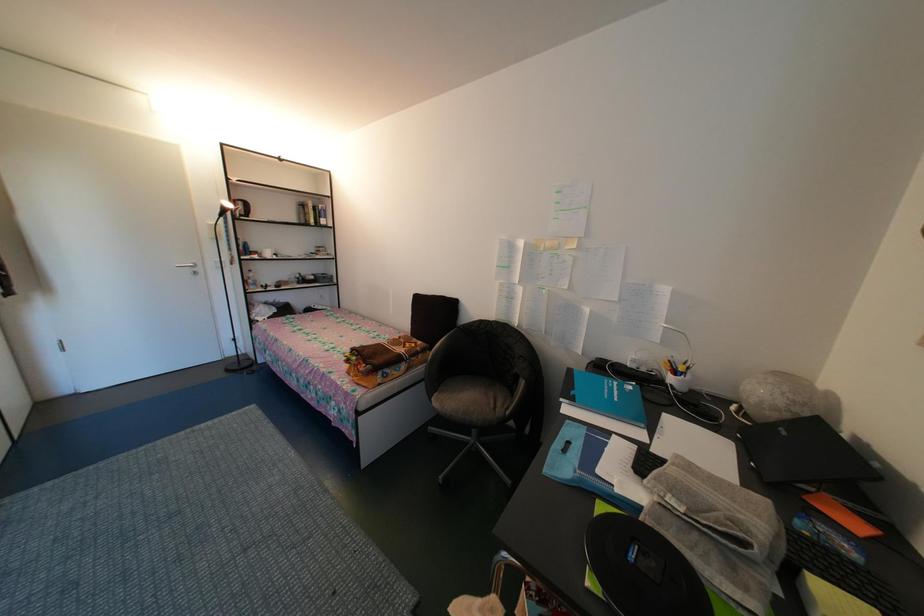
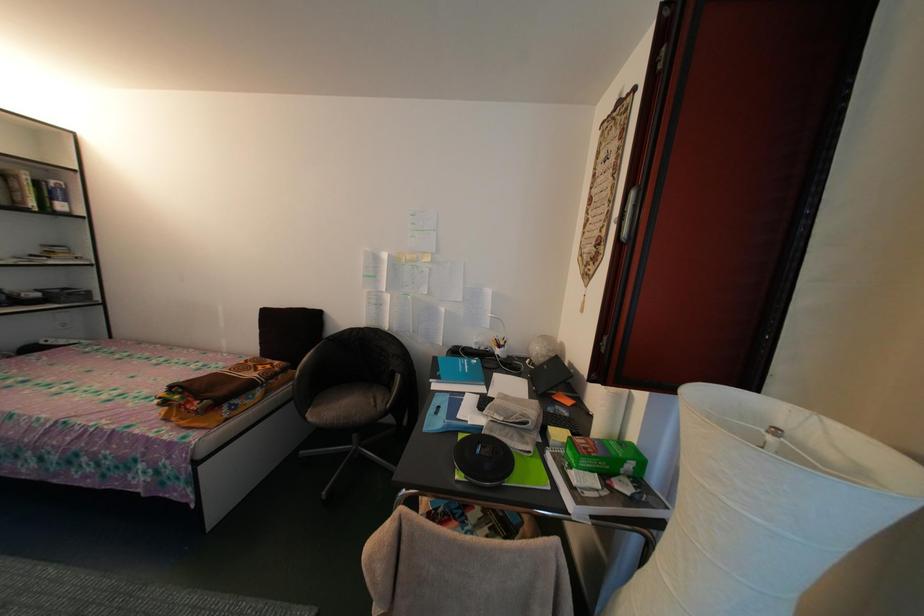
Question: The camera is either moving clockwise (left) or counter-clockwise (right) around the object. The first image is from the beginning of the video and the second image is from the end. Is the camera moving left or right when shooting the video?

Choices:
 (A) Left
 (B) Right

Answer: (A)